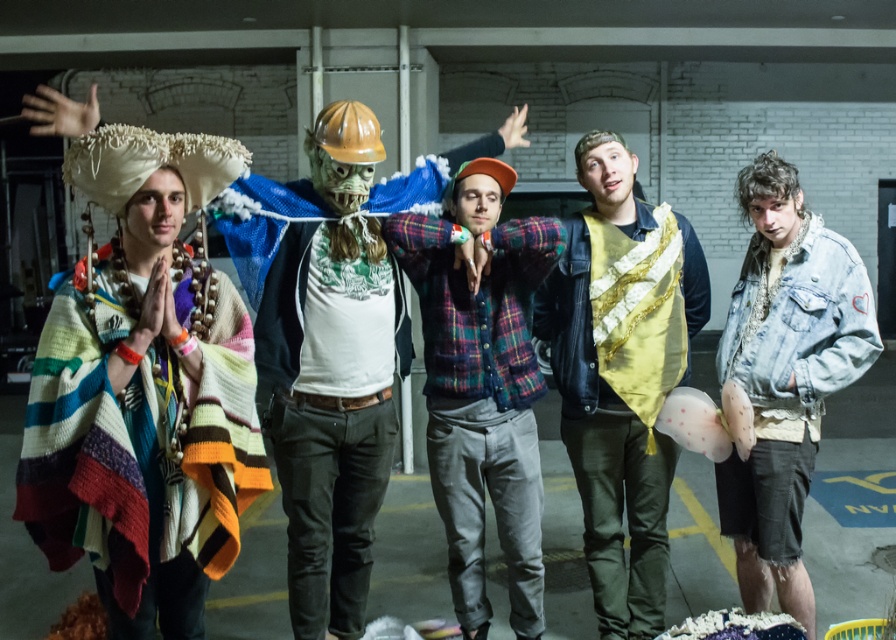
Does knitted wool poncho at left appear on the left side of hard plastic mask at center?

Yes, knitted wool poncho at left is to the left of hard plastic mask at center.

Measure the distance from knitted wool poncho at left to hard plastic mask at center.

knitted wool poncho at left and hard plastic mask at center are 70.81 centimeters apart.

Is point (140, 307) less distant than point (304, 609)?

That is True.

Image resolution: width=896 pixels, height=640 pixels. I want to click on knitted wool poncho at left, so click(x=143, y=392).

Which is below, knitted wool sweater at left or denim jacket at lower right?

Positioned lower is denim jacket at lower right.

Is knitted wool sweater at left above denim jacket at lower right?

Indeed, knitted wool sweater at left is positioned over denim jacket at lower right.

This screenshot has height=640, width=896. What are the coordinates of `knitted wool sweater at left` in the screenshot? It's located at (336, 268).

Which of these two, plaid flannel shirt at center or gold sequined vest at center, stands shorter?

gold sequined vest at center is shorter.

Is plaid flannel shirt at center smaller than gold sequined vest at center?

Indeed, plaid flannel shirt at center has a smaller size compared to gold sequined vest at center.

Identify the location of plaid flannel shirt at center. The image size is (896, 640). (481, 381).

This screenshot has height=640, width=896. I want to click on plaid flannel shirt at center, so click(481, 381).